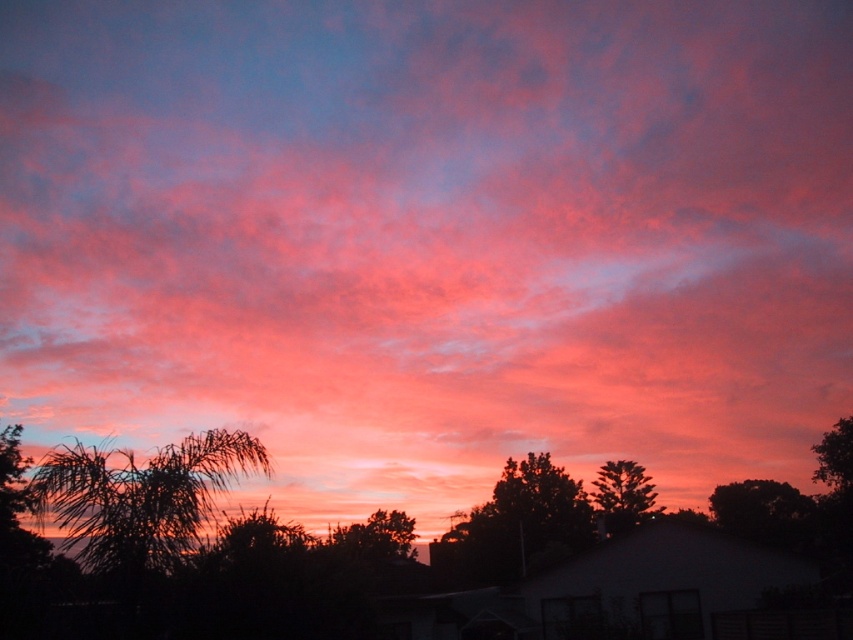
Based on the scene described, which silhouette has a greater width between the silhouette palm tree at lower left and the silhouette leafy tree at upper right?

The silhouette palm tree at lower left has a greater width than the silhouette leafy tree at upper right according to the description.